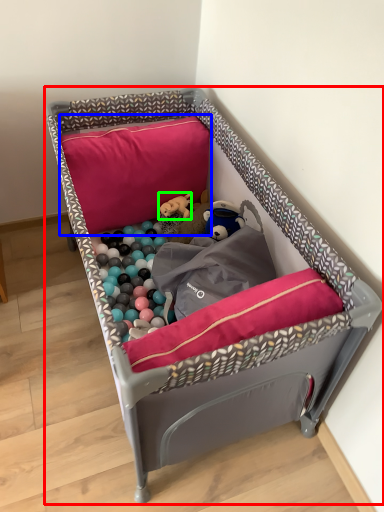
Question: Which is farther away from infant bed (highlighted by a red box)? pillow (highlighted by a blue box) or toy (highlighted by a green box)?

Choices:
 (A) pillow
 (B) toy

Answer: (B)